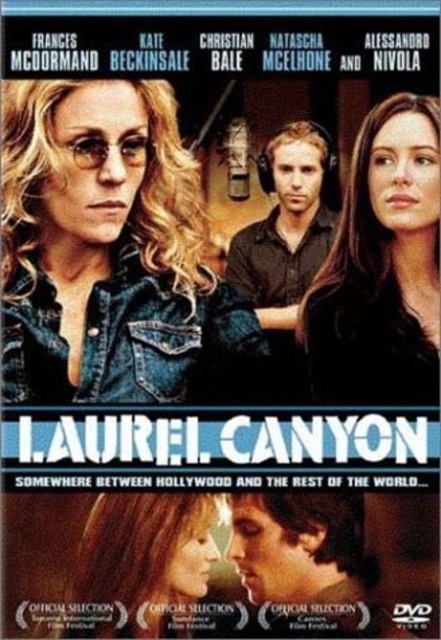
Looking at the DVD cover for the film Laurel Canyon, you notice the denim jacket at upper left and the smooth skin face at lower center. Which object is positioned higher in the image?

The denim jacket at upper left is located above the smooth skin face at lower center, so it is positioned higher in the image.

Looking at the DVD cover for the film Laurel Canyon, you see the smooth brown hair at center and the smooth skin face at lower center. Which of these two elements is positioned to the right of the other?

The smooth brown hair at center is to the right of the smooth skin face at lower center.

Based on the DVD cover for the film Laurel Canyon, can you tell me which object is located at the coordinates point (105, 248)?

The denim jacket at upper left is located at point (105, 248).